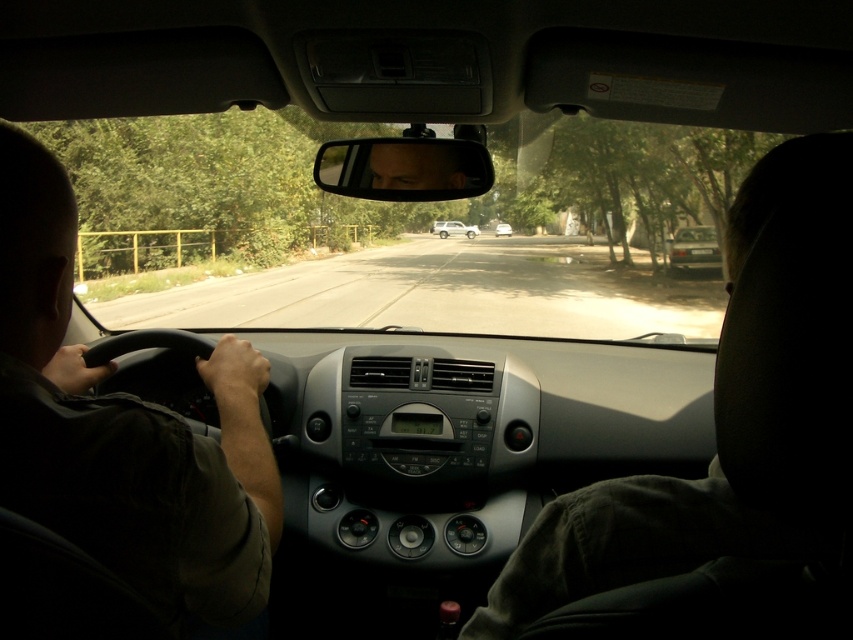
Identify the location of matte plastic view mirror at center. Image resolution: width=853 pixels, height=640 pixels. (404, 168).

Is point (485, 150) less distant than point (451, 234)?

That is True.

You are a GUI agent. You are given a task and a screenshot of the screen. Output one action in this format:
    pyautogui.click(x=<x>, y=<y>)
    Task: Click on the matte plastic view mirror at center
    
    Given the screenshot: What is the action you would take?
    pyautogui.click(x=404, y=168)

Can you confirm if dark brown leather steering wheel at left is smaller than white matte suv at center?

Yes, dark brown leather steering wheel at left is smaller than white matte suv at center.

Does dark brown leather steering wheel at left have a larger size compared to white matte suv at center?

No, dark brown leather steering wheel at left is not bigger than white matte suv at center.

At what (x,y) coordinates should I click in order to perform the action: click on dark brown leather steering wheel at left. Please return your answer as a coordinate pair (x, y). The height and width of the screenshot is (640, 853). Looking at the image, I should click on (125, 429).

Can you confirm if dark brown leather steering wheel at left is taller than matte plastic view mirror at center?

Indeed, dark brown leather steering wheel at left has a greater height compared to matte plastic view mirror at center.

Is dark brown leather steering wheel at left wider than matte plastic view mirror at center?

No.

Find the location of a particular element. This screenshot has height=640, width=853. dark brown leather steering wheel at left is located at coordinates (125, 429).